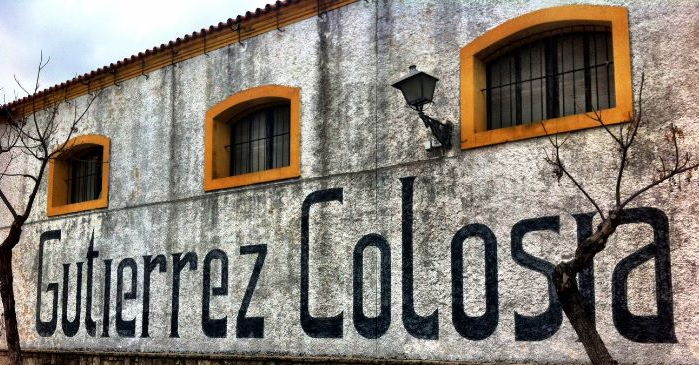
You are a GUI agent. You are given a task and a screenshot of the screen. Output one action in this format:
    pyautogui.click(x=<x>, y=<y>)
    Task: Click on the windows
    The image size is (699, 365).
    Given the screenshot: What is the action you would take?
    pyautogui.click(x=261, y=138), pyautogui.click(x=591, y=90), pyautogui.click(x=71, y=184)